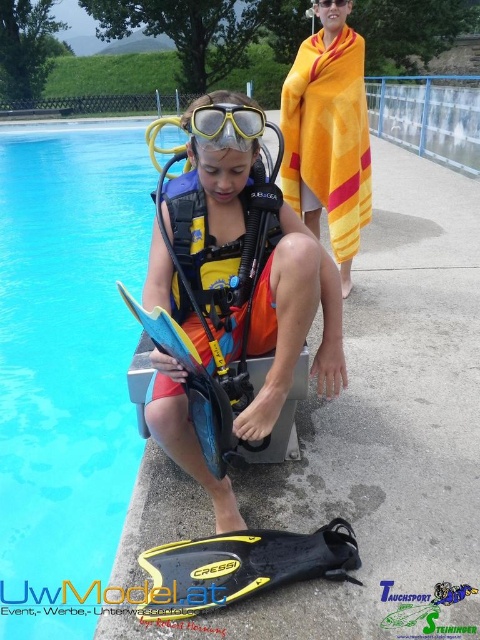
You are a lifeguard at the pool and need to locate the yellow towel at upper center. What are the coordinates where you should look?

The yellow towel at upper center is located at coordinates point (328, 132).

You are a lifeguard standing at the edge of the pool. You notice a small floating object at point (291, 321). Which object is closest to this point?

The point (291, 321) is on the yellow matte life vest at center, so the closest object to this point is the yellow matte life vest at center.

You are a lifeguard who needs to quickly grab the yellow matte life vest at center and the yellow towel at upper center. Which one is closer to your current position if you are standing at the pool edge where the person is seated?

The yellow matte life vest at center is positioned on the left side of yellow towel at upper center. Since you are standing at the pool edge where the person is seated, the yellow matte life vest at center is closer to you than the yellow towel at upper center.